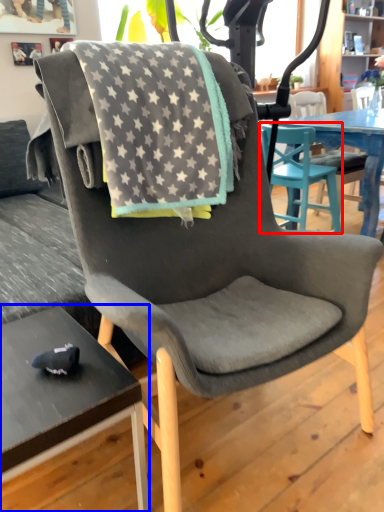
Question: Which object appears closest to the camera in this image, chair (highlighted by a red box) or desk (highlighted by a blue box)?

Choices:
 (A) chair
 (B) desk

Answer: (B)